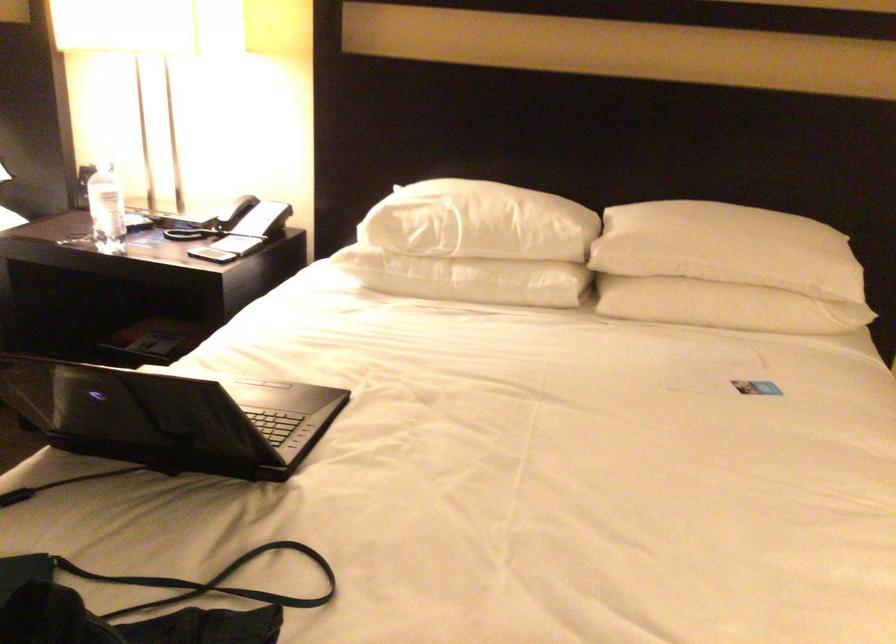
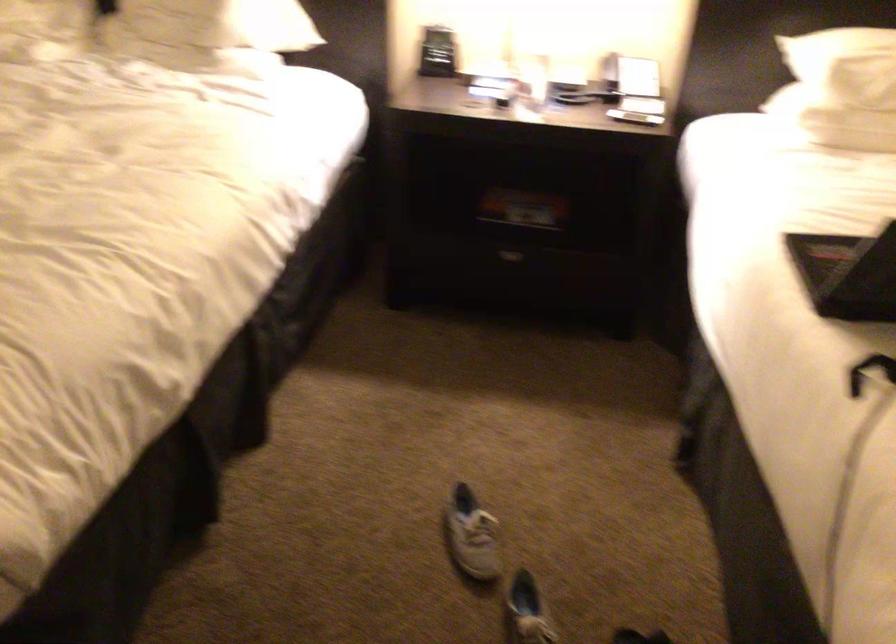
Where in the second image is the point corresponding to the point at 392,249 from the first image?

(858, 95)